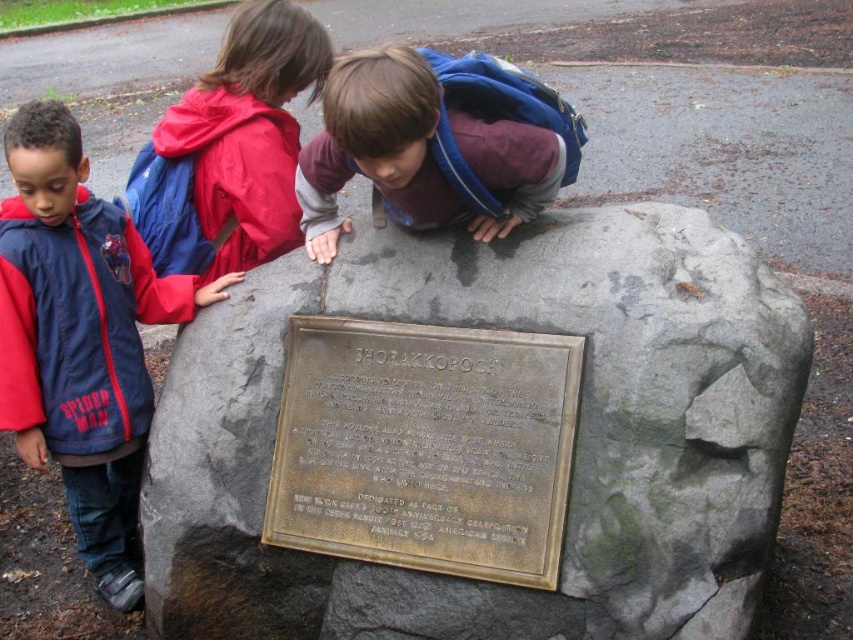
You are standing at the point marked as point (x=436, y=144). Based on the scene, what object are you currently standing on?

You are standing on the blue backpack at center because the point (x=436, y=144) is on blue backpack at center.

You are a tour guide explaining the monument to visitors. You notice the bronze plaque at center and the blue nylon jacket at left in the scene. Which object is wider?

The bronze plaque at center might be wider than blue nylon jacket at left according to the description.